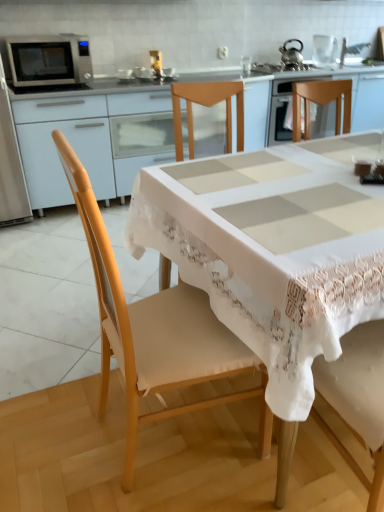
Describe the element at coordinates (352, 49) in the screenshot. The height and width of the screenshot is (512, 384). I see `white ceramic sink at upper center` at that location.

In order to face clear glass kettle at upper center, marked as the second appliance in a left-to-right arrangement, should I rotate leftwards or rightwards?

Rotate right and turn 17.697 degrees.

This screenshot has height=512, width=384. Identify the location of white lace tablecloth at center. click(x=272, y=255).

The image size is (384, 512). I want to click on matte white cabinet at upper left, so click(x=94, y=141).

I want to click on metallic gold toaster at upper center, positioned as the second appliance in right-to-left order, so click(156, 61).

Locate an element on the screen. The width and height of the screenshot is (384, 512). microwave oven that appears on the left of matte white cabinet at upper left is located at coordinates (48, 60).

Consider the image. Is matte white cabinet at upper left facing away from silver metallic microwave at upper left?

No, matte white cabinet at upper left's orientation is not away from silver metallic microwave at upper left.

In the image, is matte white cabinet at upper left on the left side or the right side of silver metallic microwave at upper left?

Based on their positions, matte white cabinet at upper left is located to the right of silver metallic microwave at upper left.

How many degrees apart are the facing directions of matte white cabinet at upper left and silver metallic microwave at upper left?

The facing directions of matte white cabinet at upper left and silver metallic microwave at upper left are 0.1 degrees apart.

Who is smaller, metallic gold toaster at upper center, which ranks as the 2th appliance in back-to-front order, or white ceramic sink at upper center?

metallic gold toaster at upper center, which ranks as the 2th appliance in back-to-front order.

Considering the relative positions of metallic gold toaster at upper center, acting as the 1th appliance starting from the front, and white ceramic sink at upper center in the image provided, is metallic gold toaster at upper center, acting as the 1th appliance starting from the front, to the left of white ceramic sink at upper center from the viewer's perspective?

Yes.

Is metallic gold toaster at upper center, which ranks as the 2th appliance in back-to-front order, facing towards white ceramic sink at upper center?

No, metallic gold toaster at upper center, which ranks as the 2th appliance in back-to-front order, is not facing towards white ceramic sink at upper center.

From a real-world perspective, is matte white cabinet at upper left beneath clear glass kettle at upper center, the second appliance positioned from the bottom?

Indeed, from a real-world perspective, matte white cabinet at upper left is positioned beneath clear glass kettle at upper center, the second appliance positioned from the bottom.

Can you tell me how much matte white cabinet at upper left and clear glass kettle at upper center, the first appliance when ordered from back to front, differ in facing direction?

There is a 93.1-degree angle between the facing directions of matte white cabinet at upper left and clear glass kettle at upper center, the first appliance when ordered from back to front.

In the scene shown: Is matte white cabinet at upper left not within clear glass kettle at upper center, the second appliance from the front?

Yes, matte white cabinet at upper left is located beyond the bounds of clear glass kettle at upper center, the second appliance from the front.

Is metallic silver tea pot at upper right far from silver metallic microwave at upper left?

Indeed, metallic silver tea pot at upper right is not near silver metallic microwave at upper left.

Can you tell me how much metallic silver tea pot at upper right and silver metallic microwave at upper left differ in facing direction?

The angle between the facing direction of metallic silver tea pot at upper right and the facing direction of silver metallic microwave at upper left is 132 degrees.

Between metallic silver tea pot at upper right and silver metallic microwave at upper left, which one has smaller width?

metallic silver tea pot at upper right is thinner.

Is the depth of metallic silver tea pot at upper right greater than that of silver metallic microwave at upper left?

Yes.

Does white lace tablecloth at center lie behind matte white cabinet at upper left?

No, it is not.

Between point (301, 277) and point (165, 141), which one is positioned behind?

Positioned behind is point (165, 141).

How many degrees apart are the facing directions of white lace tablecloth at center and matte white cabinet at upper left?

The angular difference between white lace tablecloth at center and matte white cabinet at upper left is 86.7 degrees.

Locate an element on the screen. table below the matte white cabinet at upper left (from a real-world perspective) is located at coordinates (272, 255).

Who is bigger, white lace tablecloth at center or white ceramic sink at upper center?

white lace tablecloth at center is bigger.

Which of these two, white lace tablecloth at center or white ceramic sink at upper center, stands shorter?

Standing shorter between the two is white ceramic sink at upper center.

Between white lace tablecloth at center and white ceramic sink at upper center, which one has larger width?

With larger width is white lace tablecloth at center.

Considering the positions of points (382, 263) and (344, 44), is point (382, 263) farther from camera compared to point (344, 44)?

No, (382, 263) is closer to viewer.

Would you say matte white cabinet at upper left contains white lace tablecloth at center?

That's incorrect, white lace tablecloth at center is not inside matte white cabinet at upper left.

Is matte white cabinet at upper left facing towards white lace tablecloth at center?

Yes, matte white cabinet at upper left is aimed at white lace tablecloth at center.

Between matte white cabinet at upper left and white lace tablecloth at center, which one has smaller size?

Smaller between the two is matte white cabinet at upper left.

From the image's perspective, is matte white cabinet at upper left located above white lace tablecloth at center?

Yes, from the image's perspective, matte white cabinet at upper left is on top of white lace tablecloth at center.

The image size is (384, 512). Find the location of `microwave oven above the matte white cabinet at upper left (from the image's perspective)`. microwave oven above the matte white cabinet at upper left (from the image's perspective) is located at coordinates (48, 60).

The width and height of the screenshot is (384, 512). I want to click on the 2nd appliance in front of the white ceramic sink at upper center, so click(x=156, y=61).

Consider the image. Looking at the image, which one is located further to metallic silver tea pot at upper right, silver metallic microwave at upper left or wooden chair at center?

wooden chair at center is further to metallic silver tea pot at upper right.

Looking at the image, which one is located closer to metallic silver tea pot at upper right, metallic gold toaster at upper center, the 1th appliance in the left-to-right sequence, or silver metallic microwave at upper left?

Among the two, metallic gold toaster at upper center, the 1th appliance in the left-to-right sequence, is located nearer to metallic silver tea pot at upper right.

Based on their spatial positions, is metallic silver spoon at upper center or clear glass kettle at upper center, the second appliance from the front, closer to white ceramic sink at upper center?

clear glass kettle at upper center, the second appliance from the front, lies closer to white ceramic sink at upper center than the other object.

From the image, which object appears to be nearer to silver metallic microwave at upper left, white lace tablecloth at center or metallic silver spoon at upper center?

Based on the image, metallic silver spoon at upper center appears to be nearer to silver metallic microwave at upper left.

From the image, which object appears to be nearer to metallic silver tea pot at upper right, metallic silver spoon at upper center or white lace tablecloth at center?

metallic silver spoon at upper center.

Based on their spatial positions, is white lace tablecloth at center or metallic silver spoon at upper center closer to metallic gold toaster at upper center, positioned as the second appliance in right-to-left order?

The object closer to metallic gold toaster at upper center, positioned as the second appliance in right-to-left order, is metallic silver spoon at upper center.

From the image, which object appears to be farther from silver metallic microwave at upper left, clear glass kettle at upper center, which is the 1th appliance from right to left, or white ceramic sink at upper center?

white ceramic sink at upper center is further to silver metallic microwave at upper left.

Considering their positions, is wooden chair at center positioned closer to white ceramic sink at upper center than silver metallic microwave at upper left?

silver metallic microwave at upper left lies closer to white ceramic sink at upper center than the other object.

At what (x,y) coordinates should I click in order to perform the action: click on cabinetry between wooden chair at center and metallic silver spoon at upper center from front to back. Please return your answer as a coordinate pair (x, y). Looking at the image, I should click on (94, 141).

Where is `tableware between matte white cabinet at upper left and metallic gold toaster at upper center, positioned as the second appliance in right-to-left order, along the z-axis`? The image size is (384, 512). tableware between matte white cabinet at upper left and metallic gold toaster at upper center, positioned as the second appliance in right-to-left order, along the z-axis is located at coordinates (168, 72).

I want to click on microwave oven between white lace tablecloth at center and metallic gold toaster at upper center, the 1th appliance positioned from the bottom, in the front-back direction, so click(x=48, y=60).

Locate an element on the screen. appliance located between metallic gold toaster at upper center, positioned as the second appliance in right-to-left order, and white ceramic sink at upper center in the left-right direction is located at coordinates (325, 48).